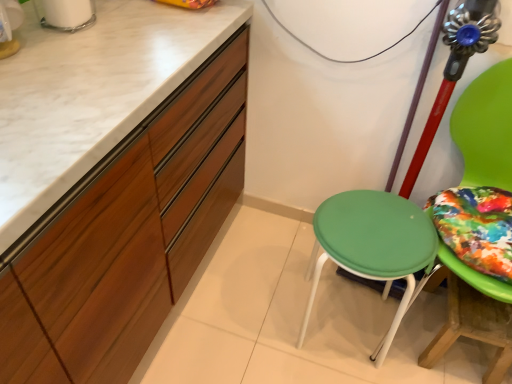
Question: Would you say wooden table at lower right is part of green plastic stool at center's contents?

Choices:
 (A) no
 (B) yes

Answer: (A)

Question: Considering the relative positions of green plastic stool at center and wooden table at lower right in the image provided, is green plastic stool at center to the right of wooden table at lower right from the viewer's perspective?

Choices:
 (A) no
 (B) yes

Answer: (A)

Question: Considering the relative sizes of green plastic stool at center and wooden table at lower right in the image provided, is green plastic stool at center shorter than wooden table at lower right?

Choices:
 (A) yes
 (B) no

Answer: (B)

Question: Is the position of green plastic stool at center more distant than that of wooden table at lower right?

Choices:
 (A) no
 (B) yes

Answer: (A)

Question: From the image's perspective, is green plastic stool at center located beneath wooden table at lower right?

Choices:
 (A) yes
 (B) no

Answer: (B)

Question: Does green plastic stool at center have a larger size compared to wooden table at lower right?

Choices:
 (A) no
 (B) yes

Answer: (B)

Question: Are green plastic stool at center and matte wood cabinetry at left far apart?

Choices:
 (A) no
 (B) yes

Answer: (A)

Question: Could you tell me if green plastic stool at center is turned towards matte wood cabinetry at left?

Choices:
 (A) yes
 (B) no

Answer: (B)

Question: From a real-world perspective, is green plastic stool at center under matte wood cabinetry at left?

Choices:
 (A) no
 (B) yes

Answer: (B)

Question: Can you confirm if green plastic stool at center is shorter than matte wood cabinetry at left?

Choices:
 (A) yes
 (B) no

Answer: (A)

Question: Is green plastic stool at center to the left of matte wood cabinetry at left from the viewer's perspective?

Choices:
 (A) no
 (B) yes

Answer: (A)

Question: Can you confirm if green plastic stool at center is taller than matte wood cabinetry at left?

Choices:
 (A) no
 (B) yes

Answer: (A)

Question: Considering the relative sizes of matte wood cabinetry at left and green plastic stool at center in the image provided, is matte wood cabinetry at left bigger than green plastic stool at center?

Choices:
 (A) no
 (B) yes

Answer: (B)